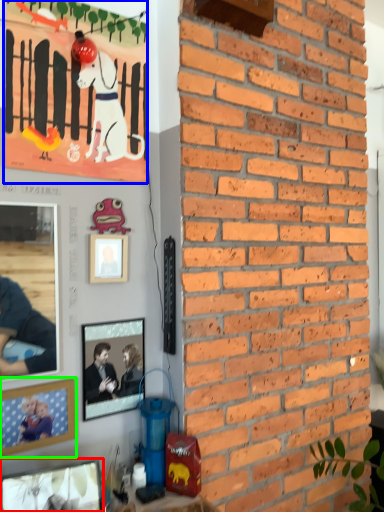
Question: Based on their relative distances, which object is nearer to picture frame (highlighted by a red box)? Choose from poster (highlighted by a blue box) and picture frame (highlighted by a green box).

Choices:
 (A) poster
 (B) picture frame

Answer: (B)